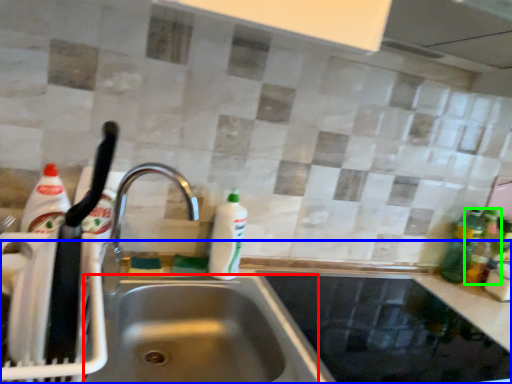
Question: Which object is the farthest from sink (highlighted by a red box)? Choose among these: counter top (highlighted by a blue box) or bottle (highlighted by a green box).

Choices:
 (A) counter top
 (B) bottle

Answer: (B)